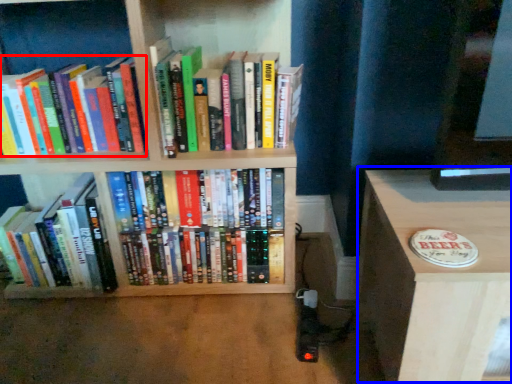
Question: Which object is closer to the camera taking this photo, book (highlighted by a red box) or table (highlighted by a blue box)?

Choices:
 (A) book
 (B) table

Answer: (B)